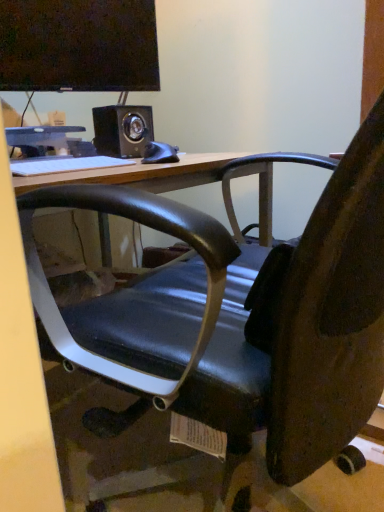
Question: From their relative heights in the image, would you say matte black monitor at upper left is taller or shorter than white glossy computer at upper left?

Choices:
 (A) short
 (B) tall

Answer: (B)

Question: Is point (89, 2) positioned closer to the camera than point (74, 125)?

Choices:
 (A) farther
 (B) closer

Answer: (B)

Question: Which is farther from the matte black monitor at upper left?

Choices:
 (A) black matte mouse at center
 (B) white glossy computer at upper left
 (C) white matte keyboard at upper center
 (D) black matte speaker at upper center

Answer: (C)

Question: Which object is the farthest from the black matte mouse at center?

Choices:
 (A) white matte keyboard at upper center
 (B) matte black monitor at upper left
 (C) white glossy computer at upper left
 (D) black matte speaker at upper center

Answer: (B)